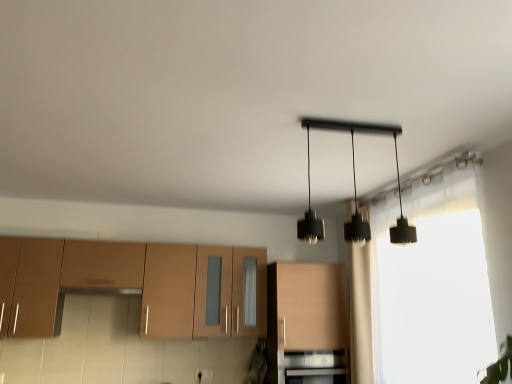
This screenshot has height=384, width=512. What do you see at coordinates (314, 367) in the screenshot?
I see `black matte oven at lower center` at bounding box center [314, 367].

Describe the element at coordinates (395, 157) in the screenshot. The image size is (512, 384). I see `black matte pendant lights at center` at that location.

The height and width of the screenshot is (384, 512). Describe the element at coordinates (306, 324) in the screenshot. I see `matte wood cabinet at center, the second cabinetry when ordered from left to right` at that location.

What do you see at coordinates (134, 285) in the screenshot? I see `brown matte cabinet at lower left, the second cabinetry in the right-to-left sequence` at bounding box center [134, 285].

At what (x,y) coordinates should I click in order to perform the action: click on black matte oven at lower center. Please return your answer as a coordinate pair (x, y). Looking at the image, I should click on (314, 367).

Can you tell me how much brown matte cabinet at lower left, the second cabinetry in the right-to-left sequence, and matte wood cabinet at center, the second cabinetry when ordered from left to right, differ in facing direction?

1.81e-05 degrees.

Could you measure the distance between brown matte cabinet at lower left, marked as the 1th cabinetry in a left-to-right arrangement, and matte wood cabinet at center, the second cabinetry when ordered from left to right?

brown matte cabinet at lower left, marked as the 1th cabinetry in a left-to-right arrangement, is 27.79 inches from matte wood cabinet at center, the second cabinetry when ordered from left to right.

Does brown matte cabinet at lower left, marked as the 1th cabinetry in a left-to-right arrangement, have a greater width compared to matte wood cabinet at center, the 1th cabinetry positioned from the right?

Incorrect, the width of brown matte cabinet at lower left, marked as the 1th cabinetry in a left-to-right arrangement, does not surpass that of matte wood cabinet at center, the 1th cabinetry positioned from the right.

Consider the image. From the image's perspective, which one is positioned lower, brown matte cabinet at lower left, the second cabinetry in the right-to-left sequence, or matte wood cabinet at center, the second cabinetry when ordered from left to right?

matte wood cabinet at center, the second cabinetry when ordered from left to right, from the image's perspective.

Is translucent fabric curtain at right placed right next to black matte pendant lights at center?

translucent fabric curtain at right and black matte pendant lights at center are clearly separated.

Does translucent fabric curtain at right have a larger size compared to black matte pendant lights at center?

Indeed, translucent fabric curtain at right has a larger size compared to black matte pendant lights at center.

Is translucent fabric curtain at right closer to camera compared to black matte pendant lights at center?

No, it is not.

Is black matte pendant lights at center at the back of translucent fabric curtain at right?

That's not correct — translucent fabric curtain at right is not looking away from black matte pendant lights at center.

Does brown matte cabinet at lower left, marked as the 1th cabinetry in a left-to-right arrangement, have a greater width compared to beige fabric curtain at center-right?

Correct, the width of brown matte cabinet at lower left, marked as the 1th cabinetry in a left-to-right arrangement, exceeds that of beige fabric curtain at center-right.

Considering the relative positions of brown matte cabinet at lower left, marked as the 1th cabinetry in a left-to-right arrangement, and beige fabric curtain at center-right in the image provided, is brown matte cabinet at lower left, marked as the 1th cabinetry in a left-to-right arrangement, to the right of beige fabric curtain at center-right from the viewer's perspective?

In fact, brown matte cabinet at lower left, marked as the 1th cabinetry in a left-to-right arrangement, is to the left of beige fabric curtain at center-right.

Between brown matte cabinet at lower left, marked as the 1th cabinetry in a left-to-right arrangement, and beige fabric curtain at center-right, which one is positioned behind?

beige fabric curtain at center-right is more distant.

Would you say translucent fabric curtain at right is part of beige fabric curtain at center-right's contents?

No.

Are beige fabric curtain at center-right and translucent fabric curtain at right making contact?

beige fabric curtain at center-right and translucent fabric curtain at right are clearly separated.

Which object is further away from the camera, beige fabric curtain at center-right or translucent fabric curtain at right?

beige fabric curtain at center-right is further away from the camera.

How many degrees apart are the facing directions of brown matte cabinet at lower left, the second cabinetry in the right-to-left sequence, and translucent fabric curtain at right?

There is a 90.2-degree angle between the facing directions of brown matte cabinet at lower left, the second cabinetry in the right-to-left sequence, and translucent fabric curtain at right.

Is brown matte cabinet at lower left, marked as the 1th cabinetry in a left-to-right arrangement, surrounding translucent fabric curtain at right?

No, translucent fabric curtain at right is located outside of brown matte cabinet at lower left, marked as the 1th cabinetry in a left-to-right arrangement.

Is brown matte cabinet at lower left, the second cabinetry in the right-to-left sequence, taller than translucent fabric curtain at right?

Incorrect, the height of brown matte cabinet at lower left, the second cabinetry in the right-to-left sequence, is not larger of that of translucent fabric curtain at right.

At what (x,y) coordinates should I click in order to perform the action: click on window on the right of brown matte cabinet at lower left, the second cabinetry in the right-to-left sequence. Please return your answer as a coordinate pair (x, y). This screenshot has height=384, width=512. Looking at the image, I should click on (425, 288).

Considering the relative positions of translucent fabric curtain at right and beige fabric curtain at center-right in the image provided, is translucent fabric curtain at right in front of beige fabric curtain at center-right?

Yes.

Which of these two, translucent fabric curtain at right or beige fabric curtain at center-right, stands taller?

Standing taller between the two is beige fabric curtain at center-right.

Are translucent fabric curtain at right and beige fabric curtain at center-right beside each other?

They are not placed beside each other.

Does translucent fabric curtain at right appear on the right side of beige fabric curtain at center-right?

Yes, translucent fabric curtain at right is to the right of beige fabric curtain at center-right.

Between black matte pendant lights at center and brown matte cabinet at lower left, marked as the 1th cabinetry in a left-to-right arrangement, which one is positioned behind?

Positioned behind is brown matte cabinet at lower left, marked as the 1th cabinetry in a left-to-right arrangement.

Considering the relative sizes of black matte pendant lights at center and brown matte cabinet at lower left, the second cabinetry in the right-to-left sequence, in the image provided, is black matte pendant lights at center taller than brown matte cabinet at lower left, the second cabinetry in the right-to-left sequence,?

No.

From the image's perspective, which is below, black matte pendant lights at center or brown matte cabinet at lower left, marked as the 1th cabinetry in a left-to-right arrangement?

brown matte cabinet at lower left, marked as the 1th cabinetry in a left-to-right arrangement, appears lower in the image.

How many degrees apart are the facing directions of black matte pendant lights at center and brown matte cabinet at lower left, the second cabinetry in the right-to-left sequence?

90.2 degrees.

Where is `cabinetry above the matte wood cabinet at center, the second cabinetry when ordered from left to right (from the image's perspective)`? The image size is (512, 384). cabinetry above the matte wood cabinet at center, the second cabinetry when ordered from left to right (from the image's perspective) is located at coordinates (134, 285).

Where is `lamp above the translucent fabric curtain at right (from a real-world perspective)`? lamp above the translucent fabric curtain at right (from a real-world perspective) is located at coordinates (395, 157).

Based on their spatial positions, is brown matte cabinet at lower left, marked as the 1th cabinetry in a left-to-right arrangement, or beige fabric curtain at center-right further from black matte oven at lower center?

brown matte cabinet at lower left, marked as the 1th cabinetry in a left-to-right arrangement.

Looking at the image, which one is located further to black matte pendant lights at center, brown matte cabinet at lower left, the second cabinetry in the right-to-left sequence, or beige fabric curtain at center-right?

brown matte cabinet at lower left, the second cabinetry in the right-to-left sequence, lies further to black matte pendant lights at center than the other object.

Considering their positions, is black matte pendant lights at center positioned closer to black matte oven at lower center than translucent fabric curtain at right?

translucent fabric curtain at right lies closer to black matte oven at lower center than the other object.

Estimate the real-world distances between objects in this image. Which object is further from beige fabric curtain at center-right, black matte pendant lights at center or translucent fabric curtain at right?

Among the two, black matte pendant lights at center is located further to beige fabric curtain at center-right.

Looking at the image, which one is located further to beige fabric curtain at center-right, black matte oven at lower center or matte wood cabinet at center, the second cabinetry when ordered from left to right?

black matte oven at lower center.

When comparing their distances from matte wood cabinet at center, the 1th cabinetry positioned from the right, does beige fabric curtain at center-right or translucent fabric curtain at right seem closer?

beige fabric curtain at center-right is positioned closer to the anchor matte wood cabinet at center, the 1th cabinetry positioned from the right.

Based on their spatial positions, is brown matte cabinet at lower left, the second cabinetry in the right-to-left sequence, or translucent fabric curtain at right closer to black matte oven at lower center?

translucent fabric curtain at right.

Looking at the image, which one is located closer to black matte oven at lower center, beige fabric curtain at center-right or translucent fabric curtain at right?

beige fabric curtain at center-right.

The height and width of the screenshot is (384, 512). In order to click on oven situated between brown matte cabinet at lower left, the second cabinetry in the right-to-left sequence, and translucent fabric curtain at right from left to right in this screenshot , I will do `click(314, 367)`.

This screenshot has height=384, width=512. What are the coordinates of `lamp between brown matte cabinet at lower left, marked as the 1th cabinetry in a left-to-right arrangement, and beige fabric curtain at center-right from left to right` in the screenshot? It's located at (395, 157).

Where is `window between black matte pendant lights at center and matte wood cabinet at center, the second cabinetry when ordered from left to right, along the z-axis`? The height and width of the screenshot is (384, 512). window between black matte pendant lights at center and matte wood cabinet at center, the second cabinetry when ordered from left to right, along the z-axis is located at coordinates (425, 288).

Locate an element on the screen. curtain between translucent fabric curtain at right and matte wood cabinet at center, the second cabinetry when ordered from left to right, from front to back is located at coordinates (359, 291).